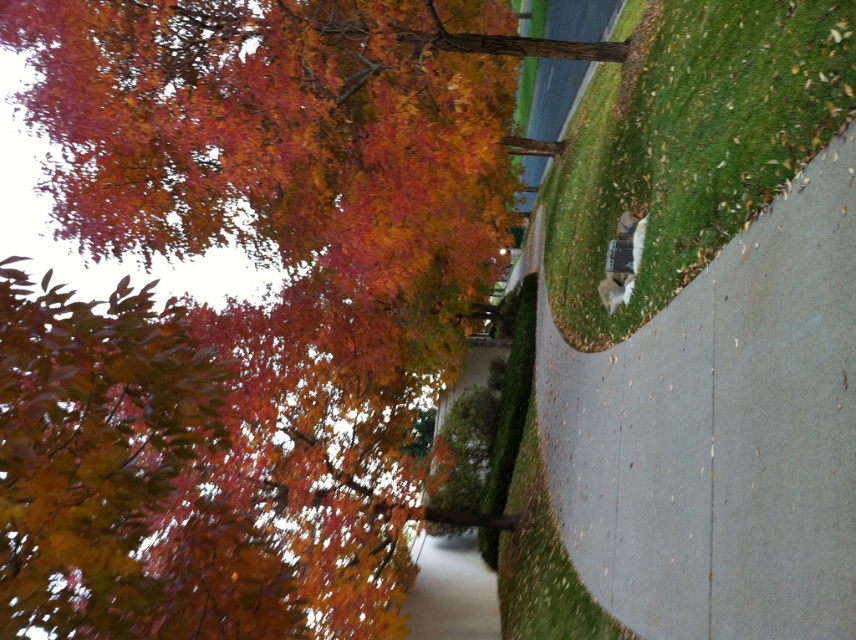
Between autumn leaves at upper left and green grass at lower right, which one is positioned lower?

autumn leaves at upper left is below.

Is point (236, 188) in front of point (817, 65)?

No.

Which is behind, point (296, 465) or point (724, 10)?

Point (296, 465)

In order to click on autumn leaves at upper left in this screenshot , I will do `click(242, 308)`.